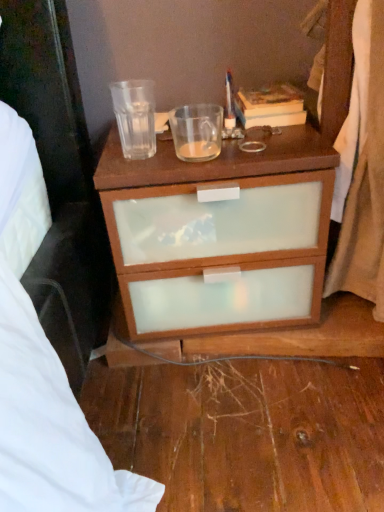
At what (x,y) coordinates should I click in order to perform the action: click on brown matte drawer at center. Please return your answer as a coordinate pair (x, y). This screenshot has width=384, height=512. Looking at the image, I should click on (219, 234).

The width and height of the screenshot is (384, 512). Describe the element at coordinates (362, 168) in the screenshot. I see `white fabric curtain at right` at that location.

This screenshot has width=384, height=512. What do you see at coordinates (197, 131) in the screenshot?
I see `translucent glass coffee cup at upper center, which appears as the 1th coffee cup when viewed from the right` at bounding box center [197, 131].

Describe the element at coordinates (135, 117) in the screenshot. I see `transparent glass at upper center, marked as the 2th coffee cup in a right-to-left arrangement` at that location.

The width and height of the screenshot is (384, 512). I want to click on hardcover book at upper right, so click(x=270, y=106).

Considering the relative sizes of transparent glass at upper center, the 1th coffee cup from the left, and white fabric curtain at right in the image provided, is transparent glass at upper center, the 1th coffee cup from the left, wider than white fabric curtain at right?

No.

From a real-world perspective, is transparent glass at upper center, marked as the 2th coffee cup in a right-to-left arrangement, positioned under white fabric curtain at right based on gravity?

No, from a real-world perspective, transparent glass at upper center, marked as the 2th coffee cup in a right-to-left arrangement, is not under white fabric curtain at right.

Is transparent glass at upper center, marked as the 2th coffee cup in a right-to-left arrangement, aimed at white fabric curtain at right?

No, transparent glass at upper center, marked as the 2th coffee cup in a right-to-left arrangement, is not turned towards white fabric curtain at right.

Is transparent glass at upper center, marked as the 2th coffee cup in a right-to-left arrangement, at the left side of white fabric curtain at right?

Indeed, transparent glass at upper center, marked as the 2th coffee cup in a right-to-left arrangement, is positioned on the left side of white fabric curtain at right.

Identify the location of curtain lying below the hardcover book at upper right (from the image's perspective). [x=362, y=168].

Can you tell me how much hardcover book at upper right and white fabric curtain at right differ in facing direction?

The angular difference between hardcover book at upper right and white fabric curtain at right is 1.09 degrees.

Between hardcover book at upper right and white fabric curtain at right, which one has more height?

white fabric curtain at right is taller.

Looking at this image, is hardcover book at upper right facing away from brown matte drawer at center?

No.

From the image's perspective, relative to brown matte drawer at center, is hardcover book at upper right above or below?

Clearly, from the image's perspective, hardcover book at upper right is above brown matte drawer at center.

Based on the photo, would you say hardcover book at upper right is outside brown matte drawer at center?

Absolutely, hardcover book at upper right is external to brown matte drawer at center.

In the scene shown: Considering the sizes of objects hardcover book at upper right and brown matte drawer at center in the image provided, who is taller, hardcover book at upper right or brown matte drawer at center?

With more height is brown matte drawer at center.

Is white fabric curtain at right facing towards transparent glass at upper center, marked as the 2th coffee cup in a right-to-left arrangement?

No, white fabric curtain at right is not turned towards transparent glass at upper center, marked as the 2th coffee cup in a right-to-left arrangement.

Visually, is white fabric curtain at right positioned to the left or to the right of transparent glass at upper center, marked as the 2th coffee cup in a right-to-left arrangement?

white fabric curtain at right is positioned on transparent glass at upper center, marked as the 2th coffee cup in a right-to-left arrangement,'s right side.

Considering the relative sizes of white fabric curtain at right and transparent glass at upper center, the 1th coffee cup from the left, in the image provided, is white fabric curtain at right bigger than transparent glass at upper center, the 1th coffee cup from the left,?

Correct, white fabric curtain at right is larger in size than transparent glass at upper center, the 1th coffee cup from the left.

Can you confirm if white fabric curtain at right is shorter than transparent glass at upper center, marked as the 2th coffee cup in a right-to-left arrangement?

Incorrect, the height of white fabric curtain at right does not fall short of that of transparent glass at upper center, marked as the 2th coffee cup in a right-to-left arrangement.

Which object is further away from the camera, brown matte drawer at center or white fabric curtain at right?

brown matte drawer at center is behind.

Is brown matte drawer at center positioned beyond the bounds of white fabric curtain at right?

Yes, brown matte drawer at center is located beyond the bounds of white fabric curtain at right.

Would you say brown matte drawer at center is a long distance from white fabric curtain at right?

No, brown matte drawer at center is not far away from white fabric curtain at right.

Considering the relative sizes of brown matte drawer at center and white fabric curtain at right in the image provided, is brown matte drawer at center wider than white fabric curtain at right?

Yes.

Is transparent glass at upper center, marked as the 2th coffee cup in a right-to-left arrangement, smaller than translucent glass coffee cup at upper center, marked as the second coffee cup in a left-to-right arrangement?

Actually, transparent glass at upper center, marked as the 2th coffee cup in a right-to-left arrangement, might be larger than translucent glass coffee cup at upper center, marked as the second coffee cup in a left-to-right arrangement.

Is transparent glass at upper center, marked as the 2th coffee cup in a right-to-left arrangement, to the left of translucent glass coffee cup at upper center, marked as the second coffee cup in a left-to-right arrangement, from the viewer's perspective?

Yes, transparent glass at upper center, marked as the 2th coffee cup in a right-to-left arrangement, is to the left of translucent glass coffee cup at upper center, marked as the second coffee cup in a left-to-right arrangement.

Between transparent glass at upper center, the 1th coffee cup from the left, and translucent glass coffee cup at upper center, marked as the second coffee cup in a left-to-right arrangement, which one has smaller width?

Thinner between the two is transparent glass at upper center, the 1th coffee cup from the left.

Is translucent glass coffee cup at upper center, marked as the second coffee cup in a left-to-right arrangement, a part of brown matte drawer at center?

No, translucent glass coffee cup at upper center, marked as the second coffee cup in a left-to-right arrangement, is located outside of brown matte drawer at center.

From a real-world perspective, is brown matte drawer at center above or below translucent glass coffee cup at upper center, marked as the second coffee cup in a left-to-right arrangement?

In terms of real-world spatial position, brown matte drawer at center is below translucent glass coffee cup at upper center, marked as the second coffee cup in a left-to-right arrangement.

What's the angular difference between brown matte drawer at center and translucent glass coffee cup at upper center, marked as the second coffee cup in a left-to-right arrangement,'s facing directions?

1.09 degrees.

Is brown matte drawer at center at the left side of translucent glass coffee cup at upper center, which appears as the 1th coffee cup when viewed from the right?

In fact, brown matte drawer at center is to the right of translucent glass coffee cup at upper center, which appears as the 1th coffee cup when viewed from the right.

Identify the location of curtain lying on the right of transparent glass at upper center, marked as the 2th coffee cup in a right-to-left arrangement. This screenshot has width=384, height=512. (362, 168).

Where is `book behind the white fabric curtain at right`? This screenshot has width=384, height=512. book behind the white fabric curtain at right is located at coordinates (270, 106).

Which object lies further to the anchor point hardcover book at upper right, white fabric curtain at right or transparent glass at upper center, the 1th coffee cup from the left?

transparent glass at upper center, the 1th coffee cup from the left, lies further to hardcover book at upper right than the other object.

From the picture: Estimate the real-world distances between objects in this image. Which object is closer to brown matte drawer at center, hardcover book at upper right or transparent glass at upper center, the 1th coffee cup from the left?

transparent glass at upper center, the 1th coffee cup from the left.

Considering their positions, is hardcover book at upper right positioned further to transparent glass at upper center, marked as the 2th coffee cup in a right-to-left arrangement, than translucent glass coffee cup at upper center, marked as the second coffee cup in a left-to-right arrangement?

The object further to transparent glass at upper center, marked as the 2th coffee cup in a right-to-left arrangement, is hardcover book at upper right.

Which object lies further to the anchor point hardcover book at upper right, white fabric curtain at right or translucent glass coffee cup at upper center, marked as the second coffee cup in a left-to-right arrangement?

Among the two, white fabric curtain at right is located further to hardcover book at upper right.

When comparing their distances from brown matte drawer at center, does hardcover book at upper right or translucent glass coffee cup at upper center, which appears as the 1th coffee cup when viewed from the right, seem closer?

translucent glass coffee cup at upper center, which appears as the 1th coffee cup when viewed from the right, is positioned closer to the anchor brown matte drawer at center.

Estimate the real-world distances between objects in this image. Which object is further from transparent glass at upper center, marked as the 2th coffee cup in a right-to-left arrangement, white fabric curtain at right or brown matte drawer at center?

white fabric curtain at right is positioned further to the anchor transparent glass at upper center, marked as the 2th coffee cup in a right-to-left arrangement.

Considering their positions, is brown matte drawer at center positioned closer to transparent glass at upper center, the 1th coffee cup from the left, than translucent glass coffee cup at upper center, which appears as the 1th coffee cup when viewed from the right?

The object closer to transparent glass at upper center, the 1th coffee cup from the left, is translucent glass coffee cup at upper center, which appears as the 1th coffee cup when viewed from the right.

Which object lies nearer to the anchor point brown matte drawer at center, white fabric curtain at right or transparent glass at upper center, marked as the 2th coffee cup in a right-to-left arrangement?

white fabric curtain at right.

This screenshot has height=512, width=384. Find the location of `desk located between transparent glass at upper center, marked as the 2th coffee cup in a right-to-left arrangement, and hardcover book at upper right in the left-right direction`. desk located between transparent glass at upper center, marked as the 2th coffee cup in a right-to-left arrangement, and hardcover book at upper right in the left-right direction is located at coordinates (219, 234).

In order to click on book located between transparent glass at upper center, the 1th coffee cup from the left, and white fabric curtain at right in the left-right direction in this screenshot , I will do `click(270, 106)`.

This screenshot has width=384, height=512. Find the location of `desk located between transparent glass at upper center, the 1th coffee cup from the left, and white fabric curtain at right in the left-right direction`. desk located between transparent glass at upper center, the 1th coffee cup from the left, and white fabric curtain at right in the left-right direction is located at coordinates (219, 234).

This screenshot has height=512, width=384. Identify the location of coffee cup between transparent glass at upper center, marked as the 2th coffee cup in a right-to-left arrangement, and brown matte drawer at center vertically. (197, 131).